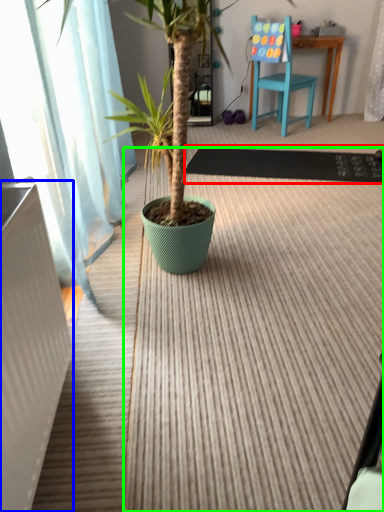
Question: Considering the real-world distances, which object is closest to doormat (highlighted by a red box)? radiator (highlighted by a blue box) or doormat (highlighted by a green box).

Choices:
 (A) radiator
 (B) doormat

Answer: (B)